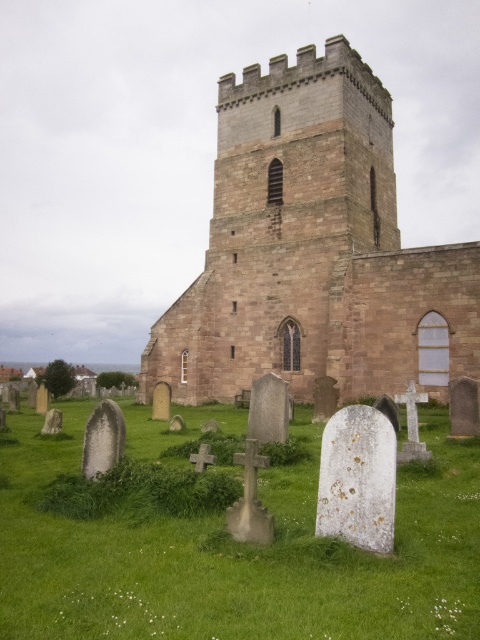
You are planning to build a new playground in the area shown in the image. The playground equipment requires a space that is wider than the brown stone church at center. Is the green grass at lower center wide enough to accommodate the playground equipment?

The brown stone church at center is narrower than the green grass at lower center, so the green grass at lower center is wide enough to accommodate the playground equipment since it is wider than the church.

You are standing in a field and see the brown stone church at center and the green grass at lower center. Which object is positioned to the right of the other?

The brown stone church at center is to the right of green grass at lower center.